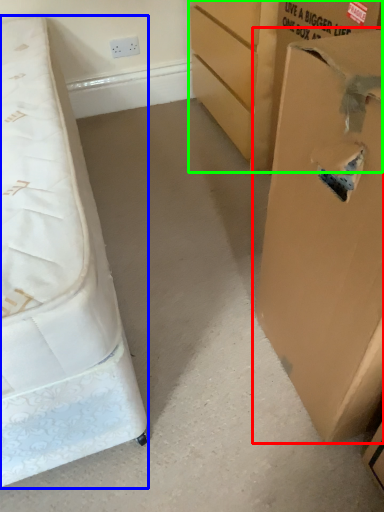
Question: Based on their relative distances, which object is nearer to cardboard box (highlighted by a red box)? Choose from bed (highlighted by a blue box) and cardboard box (highlighted by a green box).

Choices:
 (A) bed
 (B) cardboard box

Answer: (A)